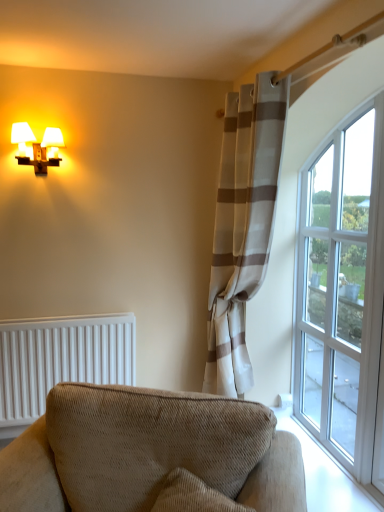
Question: Does beige corduroy couch at lower center have a smaller size compared to clear glass window at right?

Choices:
 (A) no
 (B) yes

Answer: (A)

Question: From a real-world perspective, is beige corduroy couch at lower center over clear glass window at right?

Choices:
 (A) no
 (B) yes

Answer: (A)

Question: Is beige corduroy couch at lower center facing towards clear glass window at right?

Choices:
 (A) no
 (B) yes

Answer: (A)

Question: Considering the relative sizes of beige corduroy couch at lower center and clear glass window at right in the image provided, is beige corduroy couch at lower center wider than clear glass window at right?

Choices:
 (A) yes
 (B) no

Answer: (A)

Question: Can you confirm if beige corduroy couch at lower center is shorter than clear glass window at right?

Choices:
 (A) no
 (B) yes

Answer: (B)

Question: Considering the positions of matte white sconce at upper left and white textured radiator at lower left in the image, is matte white sconce at upper left taller or shorter than white textured radiator at lower left?

Choices:
 (A) tall
 (B) short

Answer: (B)

Question: In terms of width, does matte white sconce at upper left look wider or thinner when compared to white textured radiator at lower left?

Choices:
 (A) thin
 (B) wide

Answer: (B)

Question: In the image, is matte white sconce at upper left positioned in front of or behind white textured radiator at lower left?

Choices:
 (A) front
 (B) behind

Answer: (A)

Question: From a real-world perspective, is matte white sconce at upper left positioned above or below white textured radiator at lower left?

Choices:
 (A) below
 (B) above

Answer: (B)

Question: Is white textured radiator at lower left to the left or to the right of clear glass window at right in the image?

Choices:
 (A) left
 (B) right

Answer: (A)

Question: From a real-world perspective, is white textured radiator at lower left positioned above or below clear glass window at right?

Choices:
 (A) above
 (B) below

Answer: (B)

Question: Which is correct: white textured radiator at lower left is inside clear glass window at right, or outside of it?

Choices:
 (A) inside
 (B) outside

Answer: (B)

Question: Is point (102, 317) positioned closer to the camera than point (362, 452)?

Choices:
 (A) farther
 (B) closer

Answer: (A)

Question: Based on their sizes in the image, would you say matte white sconce at upper left is bigger or smaller than beige striped curtain at right?

Choices:
 (A) big
 (B) small

Answer: (B)

Question: From a real-world perspective, is matte white sconce at upper left positioned above or below beige striped curtain at right?

Choices:
 (A) below
 (B) above

Answer: (B)